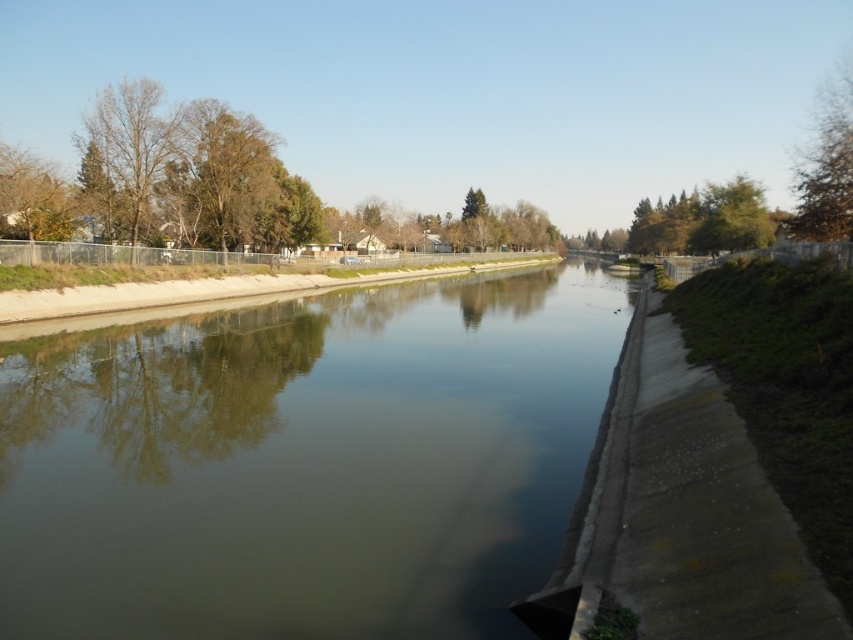
You are standing at the edge of the green concrete river at center and want to look at the green leafy tree at upper right. Which direction should you turn your head to see it?

You should turn your head to the upper right to see the green leafy tree at upper right, as it is located in that direction and is farther away from the viewer compared to the green concrete river at center.

You are standing at the edge of the waterway and want to see both the bare branches at left and the green leafy tree at upper right in your view. Which object is closer to the water surface?

The bare branches at left is located below green leafy tree at upper right, so the bare branches at left is closer to the water surface.

You are a boat operator who needs to navigate through the green concrete river at center. Considering the width of the river and the nearby green leafy tree at upper right, can you safely pass through the river without hitting the tree?

The green concrete river at center is narrower than the green leafy tree at upper right, so the boat operator must ensure they stay centered in the river to avoid hitting the tree, which is wider than the river.